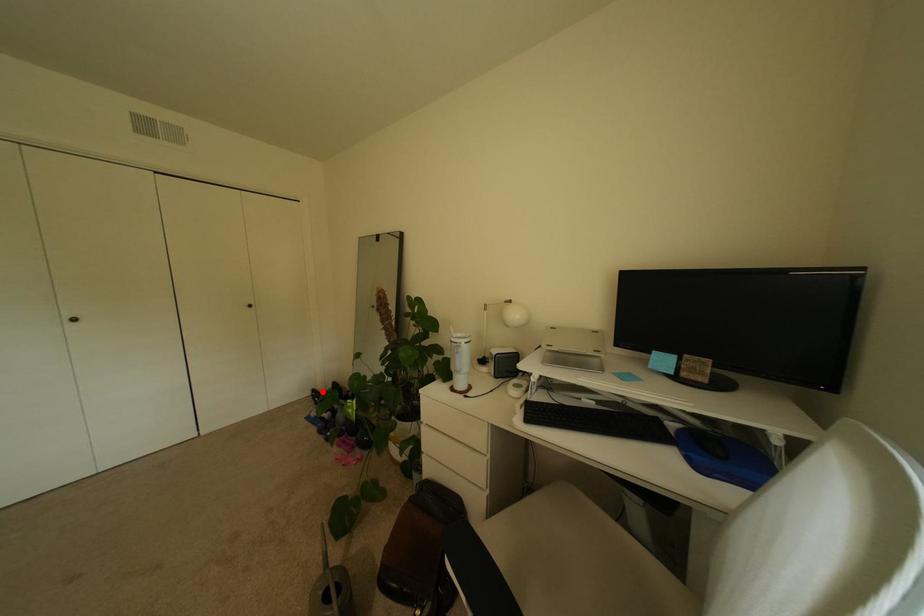
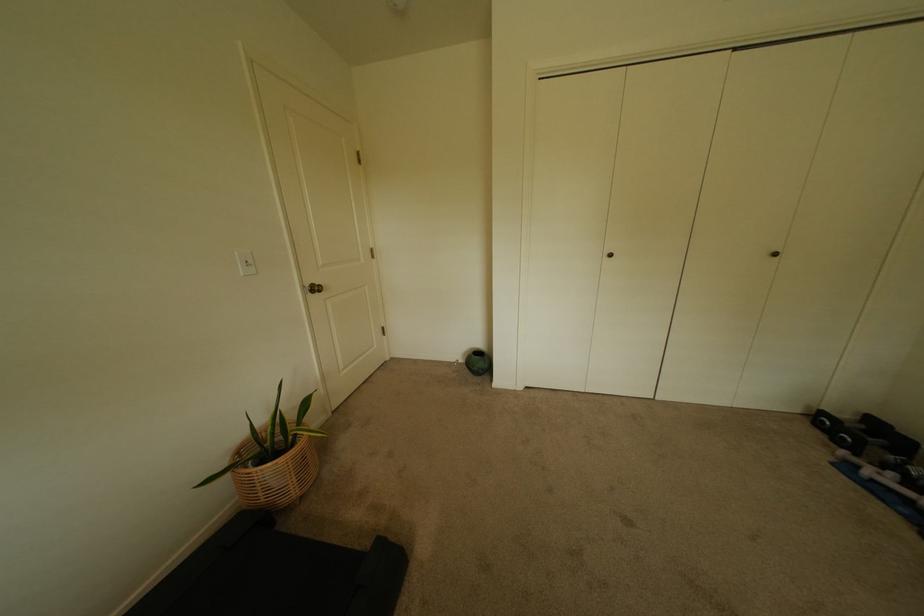
Locate, in the second image, the point that corresponds to the highlighted location in the first image.

(831, 415)